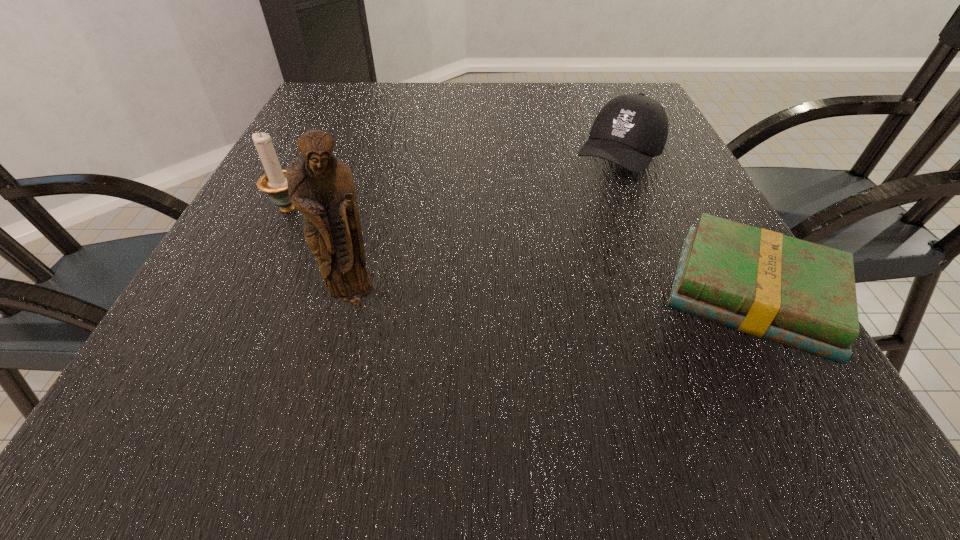
Identify the location of free area in between the figurine and the book. (554, 296).

The height and width of the screenshot is (540, 960). I want to click on free space that is in between the shortest object and the second tallest object, so click(521, 252).

Locate an element on the screen. free area in between the shortest object and the leftmost object is located at coordinates (521, 252).

Identify which object is the second closest to the book. Please provide its 2D coordinates. Your answer should be formatted as a tuple, i.e. [(x, y)], where the tuple contains the x and y coordinates of a point satisfying the conditions above.

[(321, 186)]

Where is `object identified as the closest to the second object from left to right`? The height and width of the screenshot is (540, 960). object identified as the closest to the second object from left to right is located at coordinates (274, 183).